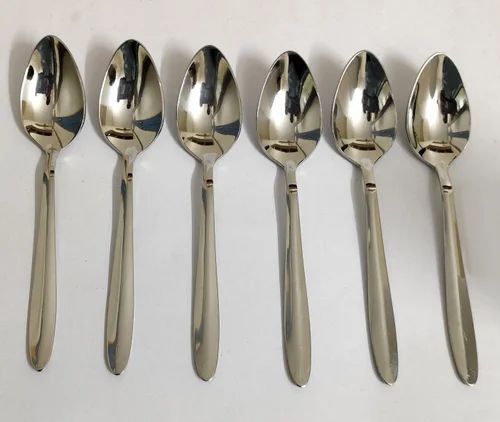
Identify the location of handles. The height and width of the screenshot is (422, 500). (31, 278), (122, 306), (200, 319), (310, 330), (388, 297), (449, 289).